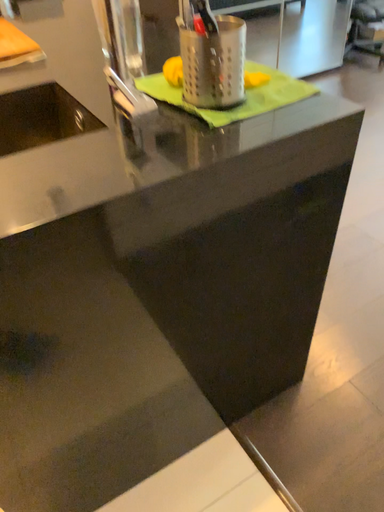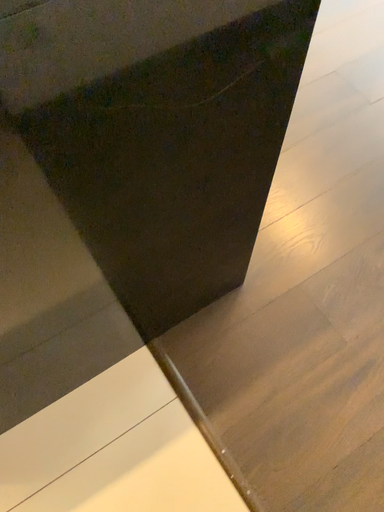
Question: Which way did the camera rotate in the video?

Choices:
 (A) rotated downward
 (B) rotated upward

Answer: (A)